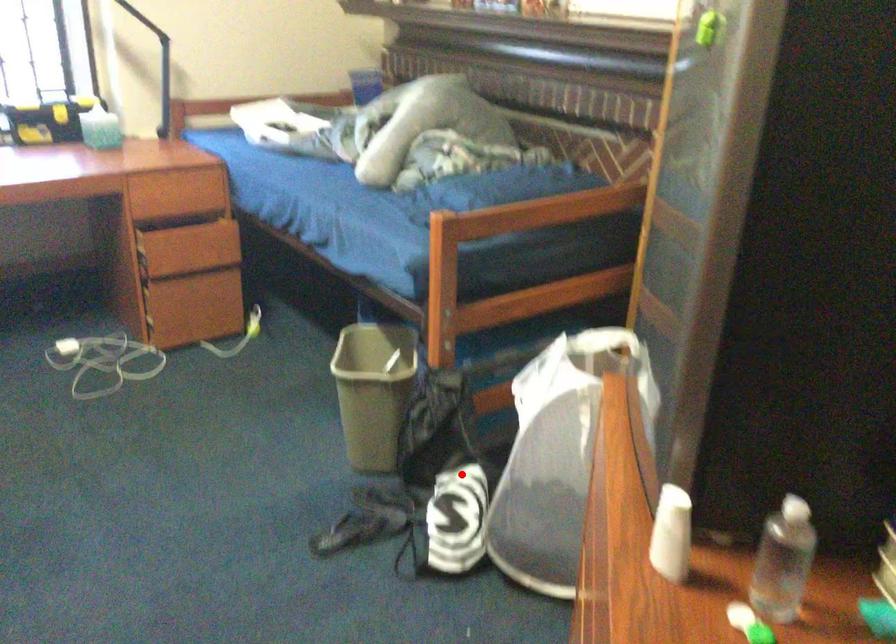
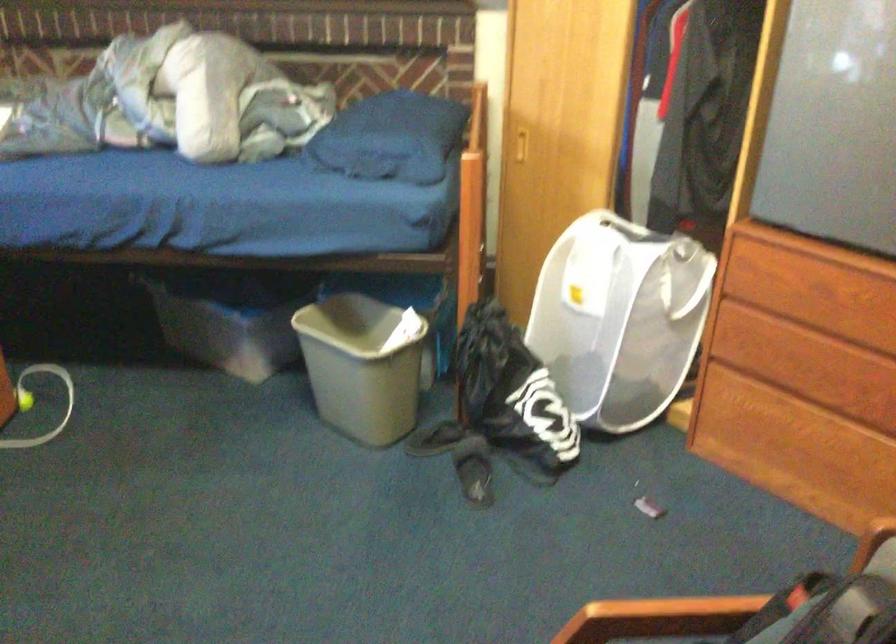
Locate, in the second image, the point that corresponds to the highlighted location in the first image.

(513, 395)